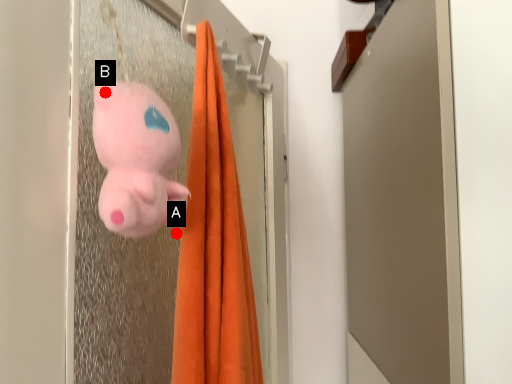
Question: Two points are circled on the image, labeled by A and B beside each circle. Which point is farther to the camera?

Choices:
 (A) A is further
 (B) B is further

Answer: (A)